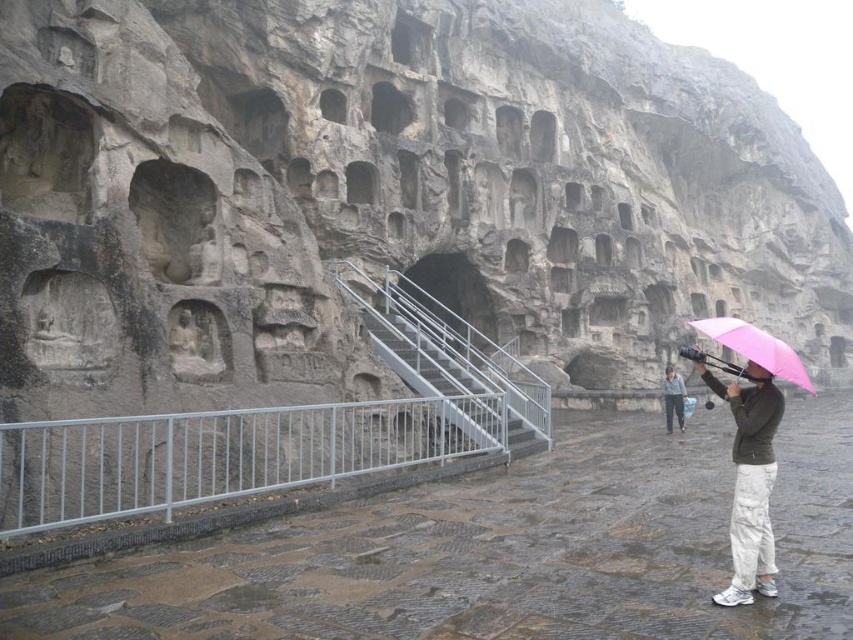
Looking at this image, does white cotton pants at lower right have a larger size compared to gray fabric jacket at center?

No.

Is white cotton pants at lower right smaller than gray fabric jacket at center?

Indeed, white cotton pants at lower right has a smaller size compared to gray fabric jacket at center.

Image resolution: width=853 pixels, height=640 pixels. In order to click on white cotton pants at lower right in this screenshot , I will do `click(750, 481)`.

Can you confirm if metal/stainless steel stairs at center is positioned above gray fabric jacket at center?

Yes.

Can you confirm if metal/stainless steel stairs at center is taller than gray fabric jacket at center?

Indeed, metal/stainless steel stairs at center has a greater height compared to gray fabric jacket at center.

This screenshot has width=853, height=640. What are the coordinates of `metal/stainless steel stairs at center` in the screenshot? It's located at (445, 353).

Can you confirm if metal/stainless steel stairs at center is wider than white cotton pants at lower right?

Indeed, metal/stainless steel stairs at center has a greater width compared to white cotton pants at lower right.

Is point (474, 364) farther from camera compared to point (734, 518)?

That is True.

Find the location of a particular element. metal/stainless steel stairs at center is located at coordinates (445, 353).